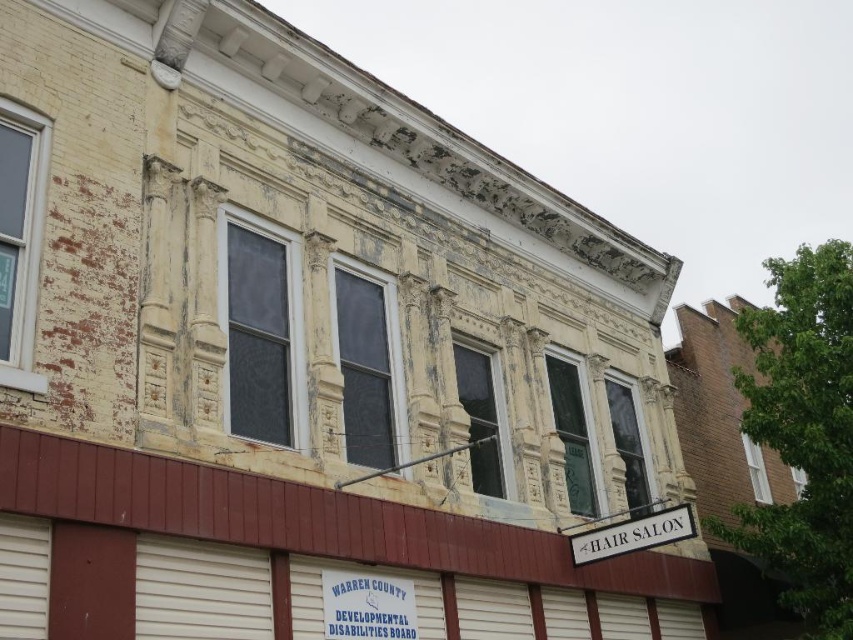
Consider the image. Can you confirm if blue plastic sign at lower center is smaller than white plastic hair salon sign at lower right?

Actually, blue plastic sign at lower center might be larger than white plastic hair salon sign at lower right.

Is the position of blue plastic sign at lower center less distant than that of white plastic hair salon sign at lower right?

Yes, blue plastic sign at lower center is in front of white plastic hair salon sign at lower right.

Is point (405, 592) behind point (693, 524)?

No, (405, 592) is in front of (693, 524).

Image resolution: width=853 pixels, height=640 pixels. Find the location of `blue plastic sign at lower center`. blue plastic sign at lower center is located at coordinates (367, 605).